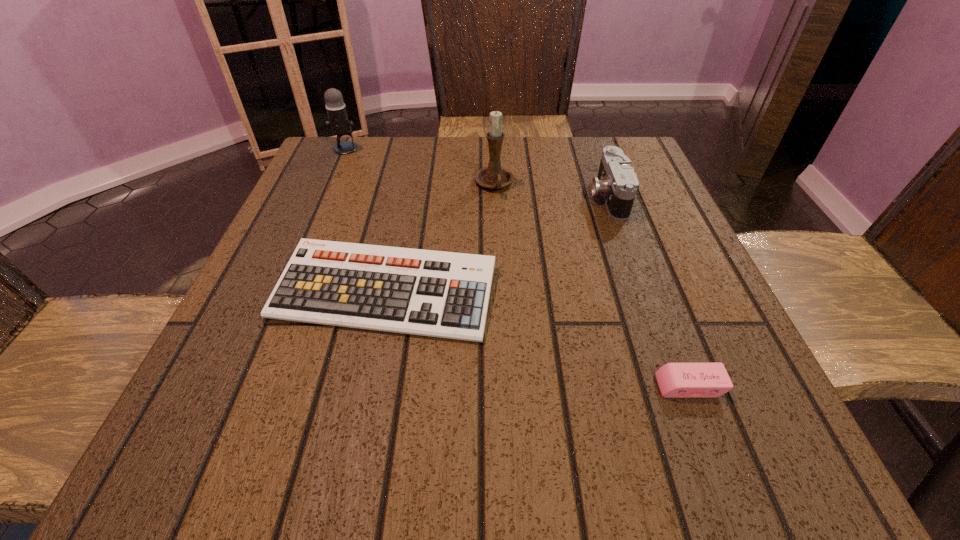
Where is `candle holder`? candle holder is located at coordinates (494, 176).

The image size is (960, 540). I want to click on microphone, so click(x=338, y=121).

Locate an element on the screen. Image resolution: width=960 pixels, height=540 pixels. the third tallest object is located at coordinates (616, 180).

The width and height of the screenshot is (960, 540). Find the location of `the second nearest object`. the second nearest object is located at coordinates (441, 294).

Find the location of a particular element. The width and height of the screenshot is (960, 540). eraser is located at coordinates (675, 380).

Where is `free space located 0.200m on the side of the candle holder with the handle`? The height and width of the screenshot is (540, 960). free space located 0.200m on the side of the candle holder with the handle is located at coordinates [497, 264].

Where is `vacant space located on the front of the microphone`? Image resolution: width=960 pixels, height=540 pixels. vacant space located on the front of the microphone is located at coordinates (335, 175).

Locate an element on the screen. This screenshot has height=540, width=960. free spot located on the lens of the camera is located at coordinates (530, 196).

Identify the location of vacant space located 0.150m on the lens of the camera. Image resolution: width=960 pixels, height=540 pixels. (520, 196).

What are the coordinates of `free point located 0.280m on the lens of the camera` in the screenshot? It's located at (460, 196).